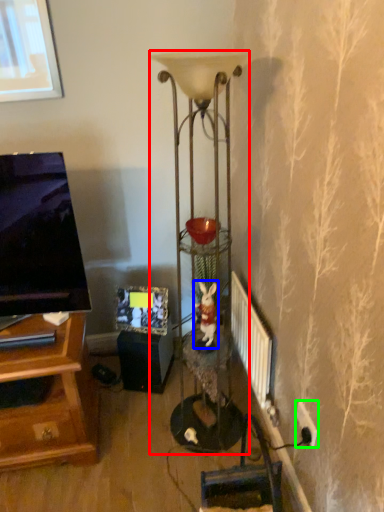
Question: Based on their relative distances, which object is farther from lamp (highlighted by a red box)? Choose from animal (highlighted by a blue box) and electric outlet (highlighted by a green box).

Choices:
 (A) animal
 (B) electric outlet

Answer: (B)